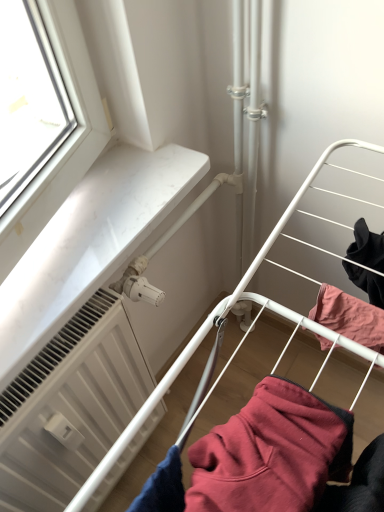
Question: Is white matte radiator at lower left facing away from maroon fleece sweatshirt at center?

Choices:
 (A) no
 (B) yes

Answer: (A)

Question: Does white matte radiator at lower left contain maroon fleece sweatshirt at center?

Choices:
 (A) yes
 (B) no

Answer: (B)

Question: Is white matte radiator at lower left not inside maroon fleece sweatshirt at center?

Choices:
 (A) no
 (B) yes

Answer: (B)

Question: Is white matte radiator at lower left wider than maroon fleece sweatshirt at center?

Choices:
 (A) no
 (B) yes

Answer: (A)

Question: Considering the relative sizes of white matte radiator at lower left and maroon fleece sweatshirt at center in the image provided, is white matte radiator at lower left bigger than maroon fleece sweatshirt at center?

Choices:
 (A) no
 (B) yes

Answer: (B)

Question: Is white matte radiator at lower left thinner than maroon fleece sweatshirt at center?

Choices:
 (A) yes
 (B) no

Answer: (A)

Question: From a real-world perspective, is maroon fleece sweatshirt at center physically above white matte radiator at lower left?

Choices:
 (A) no
 (B) yes

Answer: (B)

Question: From the image's perspective, is maroon fleece sweatshirt at center above white matte radiator at lower left?

Choices:
 (A) yes
 (B) no

Answer: (A)

Question: Is maroon fleece sweatshirt at center positioned beyond the bounds of white matte radiator at lower left?

Choices:
 (A) no
 (B) yes

Answer: (B)

Question: Is white matte radiator at lower left a part of maroon fleece sweatshirt at center?

Choices:
 (A) yes
 (B) no

Answer: (B)

Question: Is maroon fleece sweatshirt at center not close to white matte radiator at lower left?

Choices:
 (A) yes
 (B) no

Answer: (B)

Question: Can you confirm if maroon fleece sweatshirt at center is taller than white matte radiator at lower left?

Choices:
 (A) yes
 (B) no

Answer: (B)

Question: Based on their sizes in the image, would you say maroon fleece sweatshirt at center is bigger or smaller than white matte radiator at lower left?

Choices:
 (A) small
 (B) big

Answer: (A)